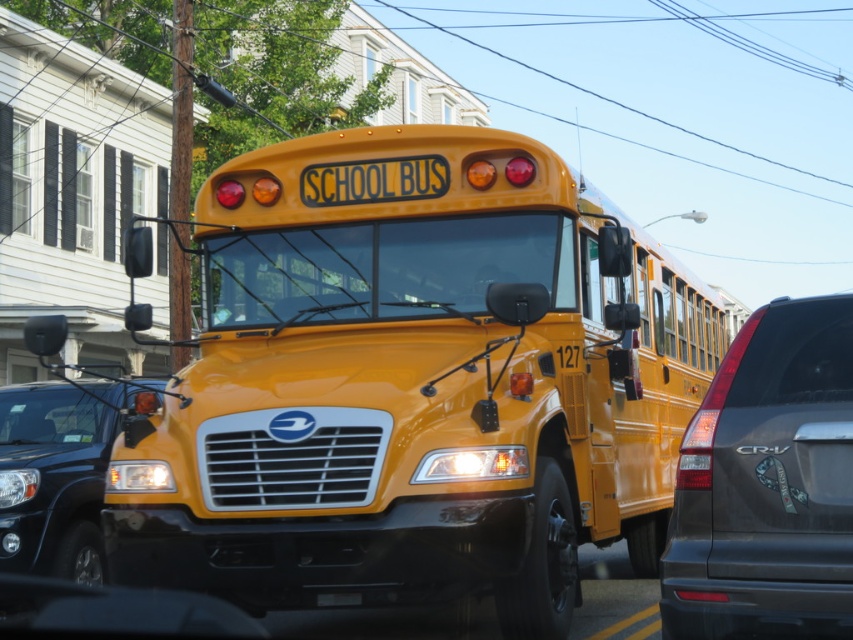
You are driving a car that is 1.8 meters wide and want to pass the matte black suv at right. Based on the distance between your car and the suv, can you safely make a left turn around it without hitting it?

The matte black suv at right is 3.65 meters away from camera. Since your car is 1.8 meters wide, you have enough space to safely make a left turn around it as the distance is more than twice the width of your car.